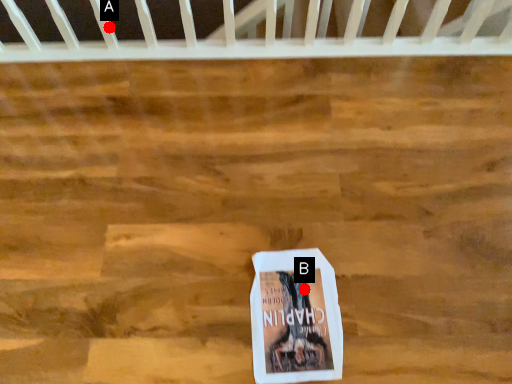
Question: Two points are circled on the image, labeled by A and B beside each circle. Which point appears closest to the camera in this image?

Choices:
 (A) A is closer
 (B) B is closer

Answer: (B)